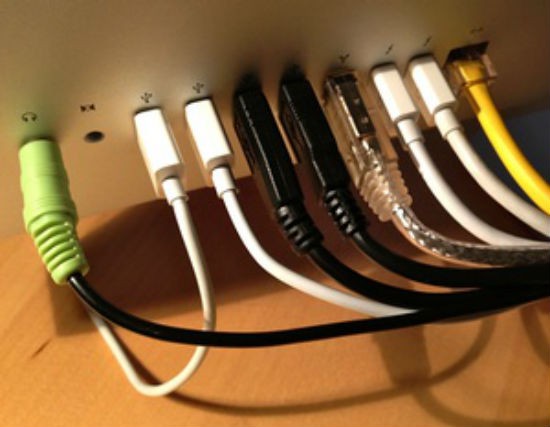
The width and height of the screenshot is (550, 427). What are the coordinates of `cable plugs` in the screenshot? It's located at (41, 156), (155, 141), (204, 132), (261, 127), (301, 120), (346, 97), (395, 90), (424, 83), (467, 75).